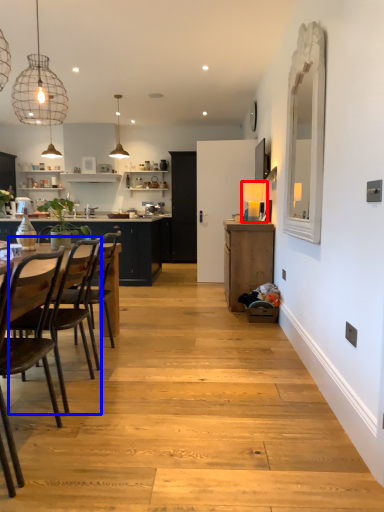
Question: Which point is closer to the camera, lamp (highlighted by a red box) or chair (highlighted by a blue box)?

Choices:
 (A) lamp
 (B) chair

Answer: (B)